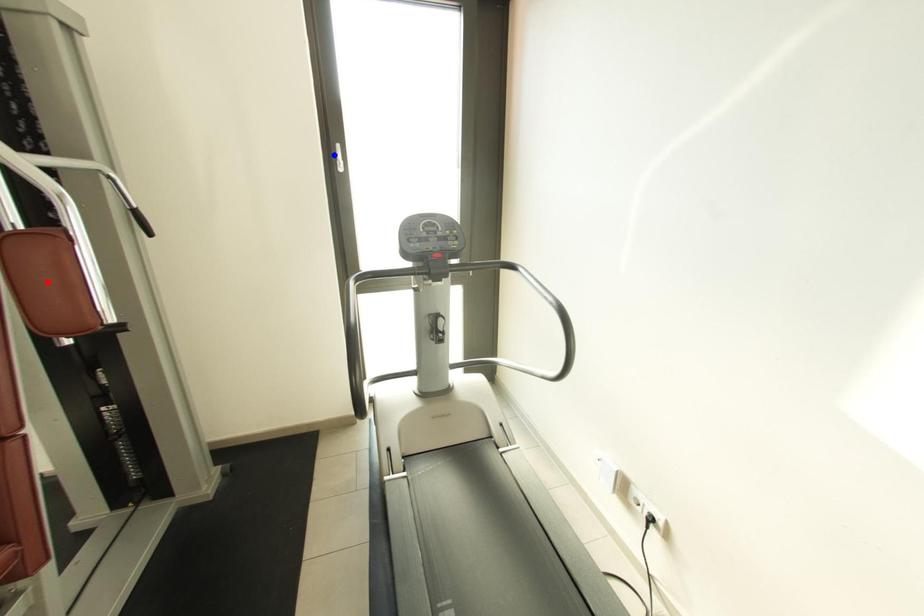
Question: In the image, two points are highlighted. Which point is nearer to the camera? Reply with the corresponding letter.

Choices:
 (A) blue point
 (B) red point

Answer: (B)